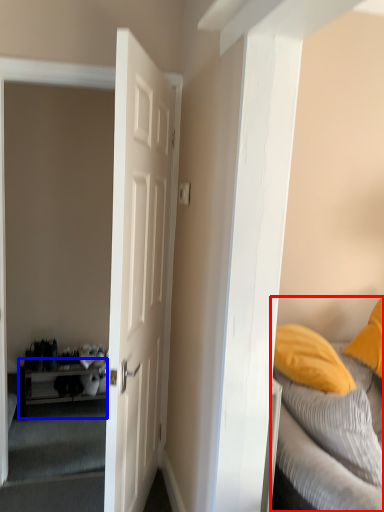
Question: Among these objects, which one is farthest to the camera, bed (highlighted by a red box) or table (highlighted by a blue box)?

Choices:
 (A) bed
 (B) table

Answer: (B)